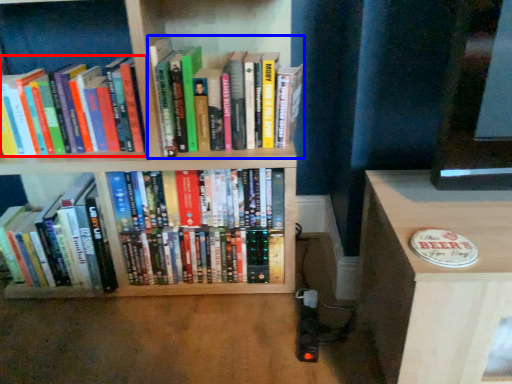
Question: Which object appears closest to the camera in this image, book (highlighted by a red box) or book (highlighted by a blue box)?

Choices:
 (A) book
 (B) book

Answer: (B)